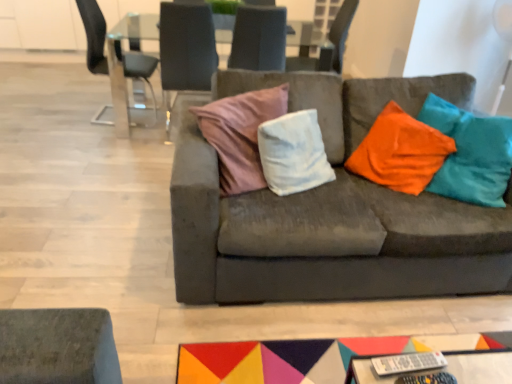
You are a GUI agent. You are given a task and a screenshot of the screen. Output one action in this format:
    pyautogui.click(x=<x>, y=<y>)
    Task: Click on the vacant area that is in front of transparent glass table at upper center
    
    Given the screenshot: What is the action you would take?
    pyautogui.click(x=105, y=182)